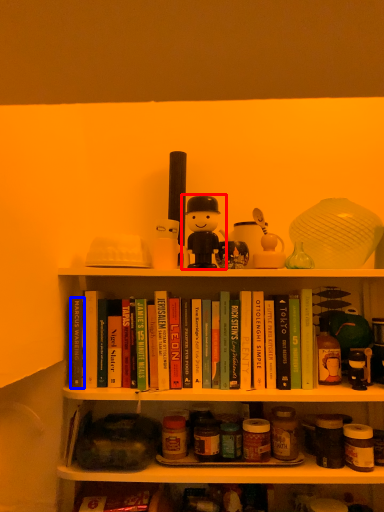
Question: Which object appears closest to the camera in this image, toy (highlighted by a red box) or paperback book (highlighted by a blue box)?

Choices:
 (A) toy
 (B) paperback book

Answer: (A)